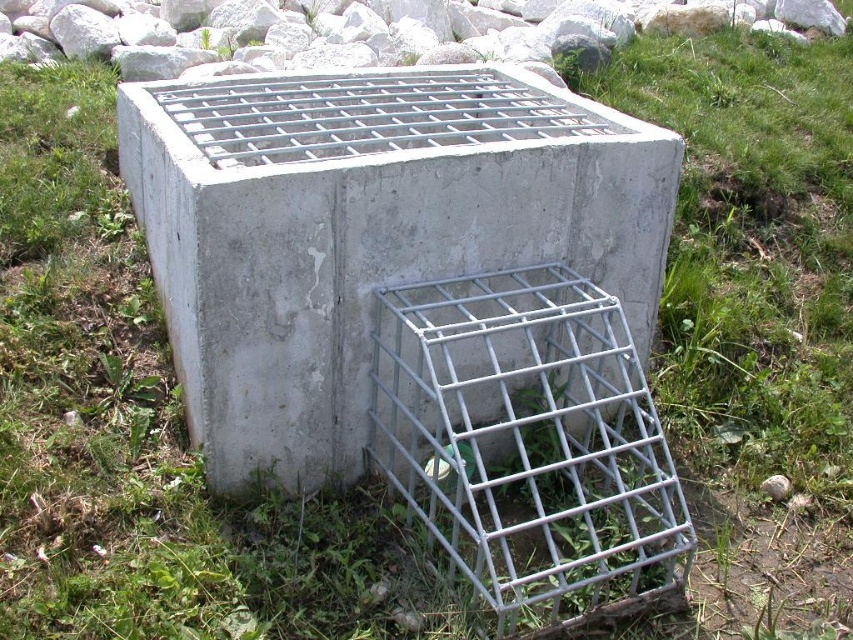
You are a construction worker who needs to place a new utility box at the exact coordinates of the gray concrete block at center. What are the coordinates where you should place it?

The gray concrete block at center is located at coordinates point [364,230], so you should place the new utility box there.

You are a maintenance worker inspecting the area around the gray concrete block at center and the galvanized metal bird cage at center. Which object is positioned more to the right side of the scene?

The galvanized metal bird cage at center is positioned more to the right side of the scene because the gray concrete block at center is to the left of it.

You are standing in front of a concrete structure and see a point marked at coordinates (364, 230). Based on the scene description, what object does this point most likely correspond to?

The point at coordinates (364, 230) corresponds to the gray concrete block at center as described in the scene.